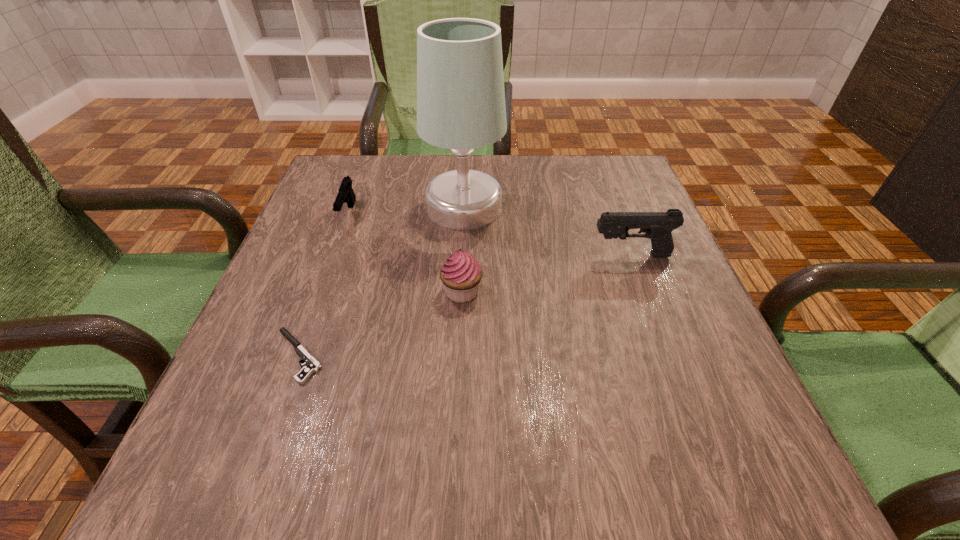
Find the location of a particular element. free space that satisfies the following two spatial constraints: 1. on the base of the lampshade; 2. on the left side of the second nearest object is located at coordinates (461, 292).

This screenshot has width=960, height=540. Find the location of `free location that satisfies the following two spatial constraints: 1. on the base of the cupcake; 2. on the left side of the lampshade`. free location that satisfies the following two spatial constraints: 1. on the base of the cupcake; 2. on the left side of the lampshade is located at coordinates (461, 292).

Image resolution: width=960 pixels, height=540 pixels. I want to click on vacant area in the image that satisfies the following two spatial constraints: 1. on the base of the tallest object; 2. on the left side of the cupcake, so click(x=461, y=292).

Find the location of a particular element. This screenshot has height=540, width=960. vacant region that satisfies the following two spatial constraints: 1. on the base of the tallest object; 2. on the front-facing side of the fourth tallest object is located at coordinates (464, 214).